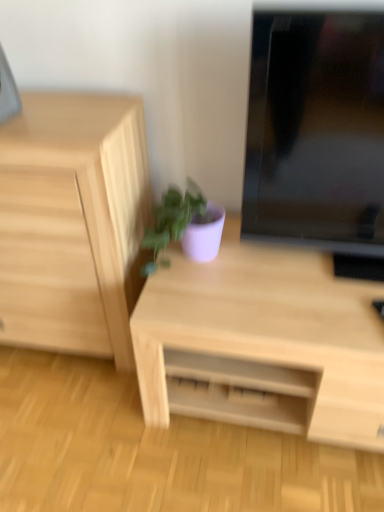
Question: Is light wood chest of drawers at left bigger than black glossy monitor at upper right?

Choices:
 (A) yes
 (B) no

Answer: (A)

Question: Does light wood chest of drawers at left come behind black glossy monitor at upper right?

Choices:
 (A) yes
 (B) no

Answer: (A)

Question: From a real-world perspective, is light wood chest of drawers at left positioned over black glossy monitor at upper right based on gravity?

Choices:
 (A) yes
 (B) no

Answer: (B)

Question: Is black glossy monitor at upper right at the back of light wood chest of drawers at left?

Choices:
 (A) no
 (B) yes

Answer: (A)

Question: From the image's perspective, would you say light wood chest of drawers at left is shown under black glossy monitor at upper right?

Choices:
 (A) yes
 (B) no

Answer: (A)

Question: Does light wood chest of drawers at left have a smaller size compared to black glossy monitor at upper right?

Choices:
 (A) no
 (B) yes

Answer: (A)

Question: Could black glossy monitor at upper right be considered to be inside light wood desk at center?

Choices:
 (A) no
 (B) yes

Answer: (A)

Question: Can you confirm if light wood desk at center is wider than black glossy monitor at upper right?

Choices:
 (A) yes
 (B) no

Answer: (A)

Question: Is the position of light wood desk at center less distant than that of black glossy monitor at upper right?

Choices:
 (A) no
 (B) yes

Answer: (A)

Question: Is light wood desk at center positioned with its back to black glossy monitor at upper right?

Choices:
 (A) no
 (B) yes

Answer: (A)

Question: Does light wood desk at center appear on the left side of black glossy monitor at upper right?

Choices:
 (A) yes
 (B) no

Answer: (A)

Question: Does light wood desk at center appear on the right side of black glossy monitor at upper right?

Choices:
 (A) no
 (B) yes

Answer: (A)

Question: Does light wood desk at center have a larger size compared to matte purple pot at center?

Choices:
 (A) no
 (B) yes

Answer: (B)